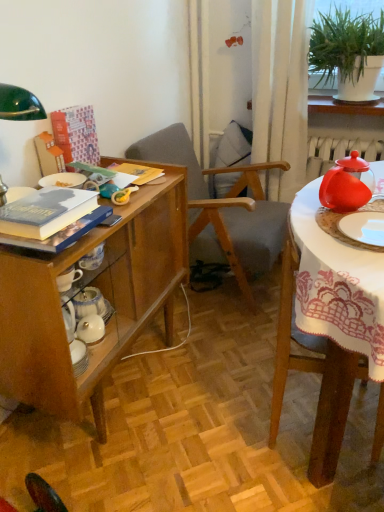
Identify the location of vacant space underneath wooden desk at left (from a real-world perspective). (129, 384).